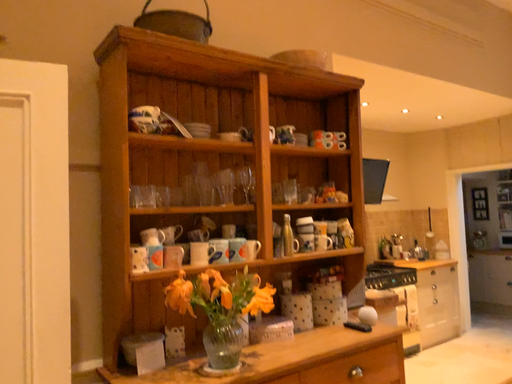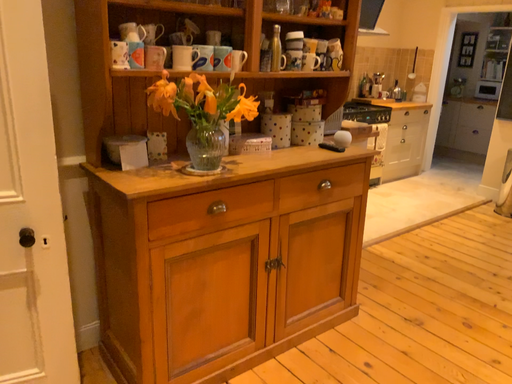
Question: How did the camera likely rotate when shooting the video?

Choices:
 (A) rotated upward
 (B) rotated downward

Answer: (B)